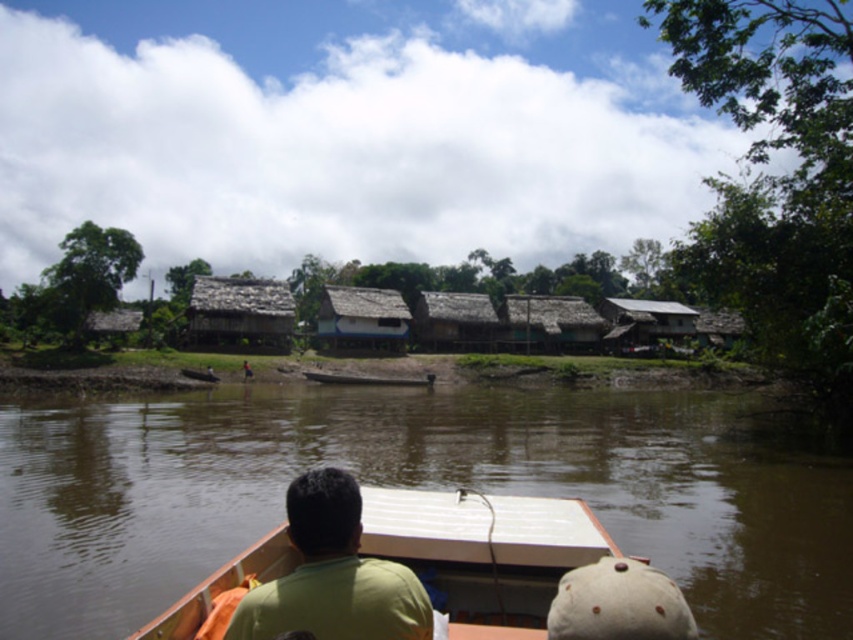
You are planning to build a new house on the riverside. The brown wooden hut at center and the thatched roof hut at left are existing structures. Which existing house can you build a new house next to without violating the local zoning law that requires new constructions to be at least 10 meters away from any larger existing structure?

The brown wooden hut at center is larger in size than the thatched roof hut at left. Therefore, you must maintain a 10 meter distance from the brown wooden hut at center when building the new house. The thatched roof hut at left is smaller, so you can build next to it as long as it is at least 10 meters away from the larger brown wooden hut at center.